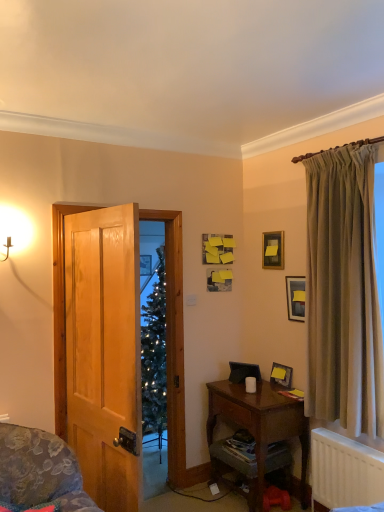
Locate an element on the screen. vacant space that is in between white matte coffee cup at lower center and matte black picture frame at lower right, which appears as the 1th picture frame when ordered from the bottom is located at coordinates (265, 390).